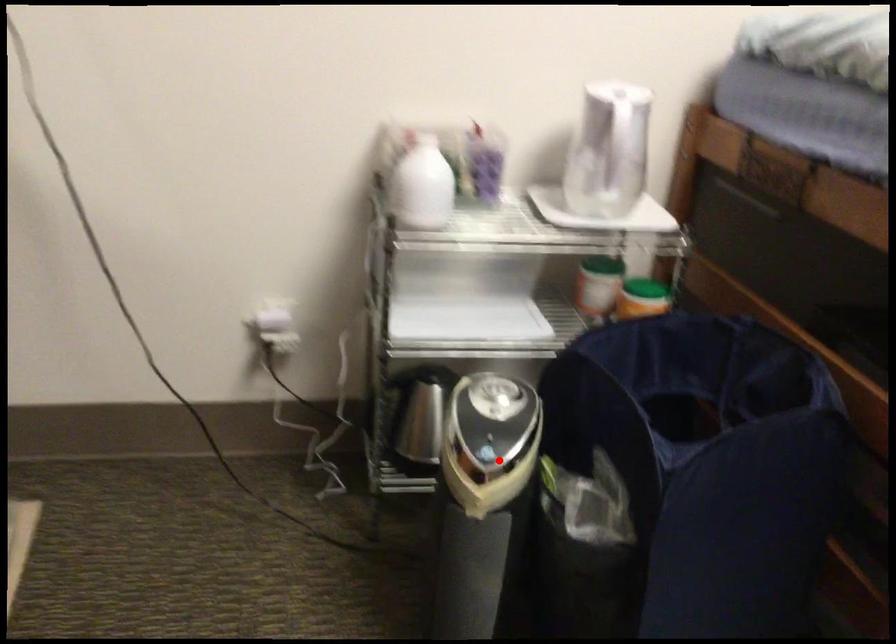
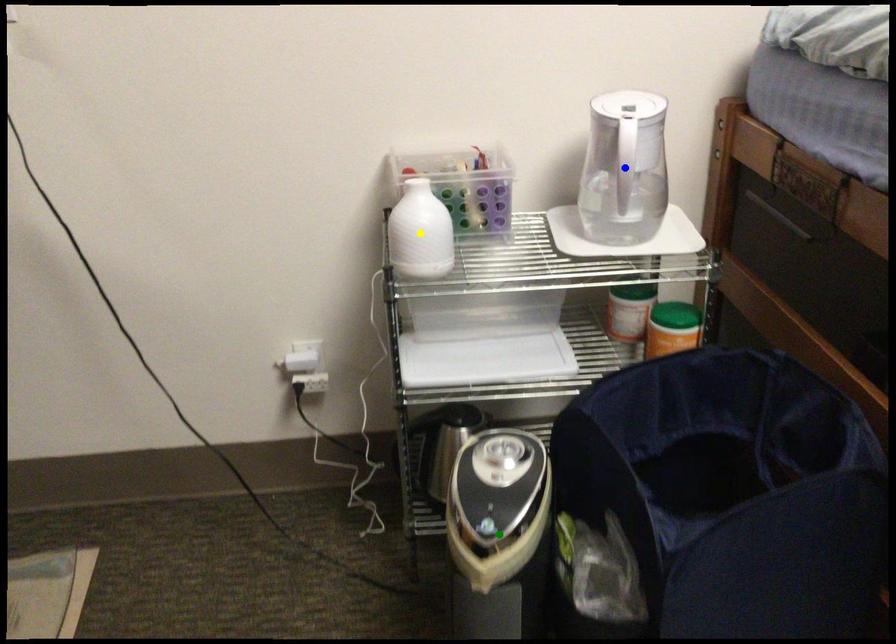
Question: I am providing you with two images of the same scene from different viewpoints. A red point is marked on the first image. You are given multiple points on the second image. Which spot in image 2 lines up with the point in image 1?

Choices:
 (A) green point
 (B) yellow point
 (C) blue point

Answer: (A)